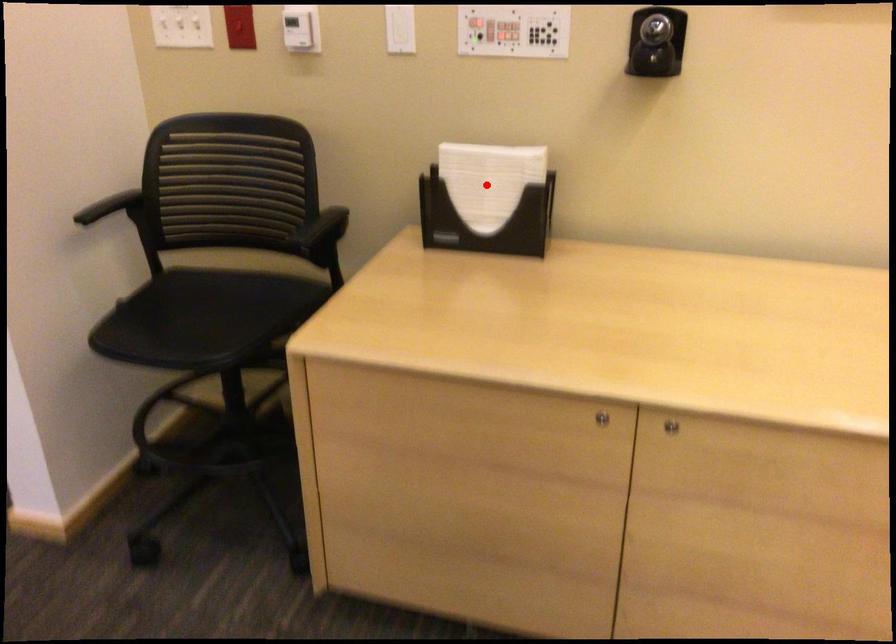
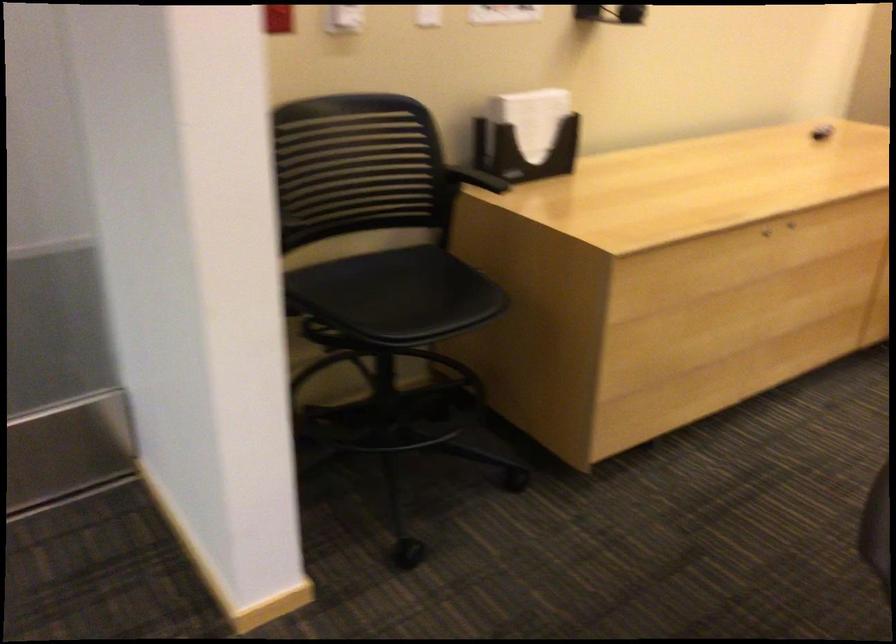
Question: I am providing you with two images of the same scene from different viewpoints. Image1 has a red point marked. In image2, the corresponding 3D location appears at what relative position? Reply with the corresponding letter.

Choices:
 (A) Closer
 (B) Farther

Answer: (B)